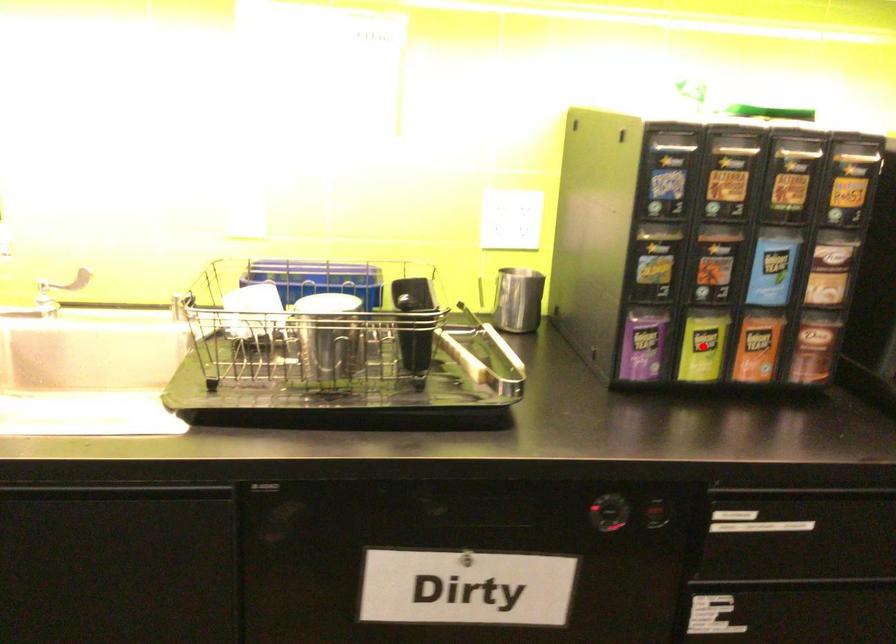
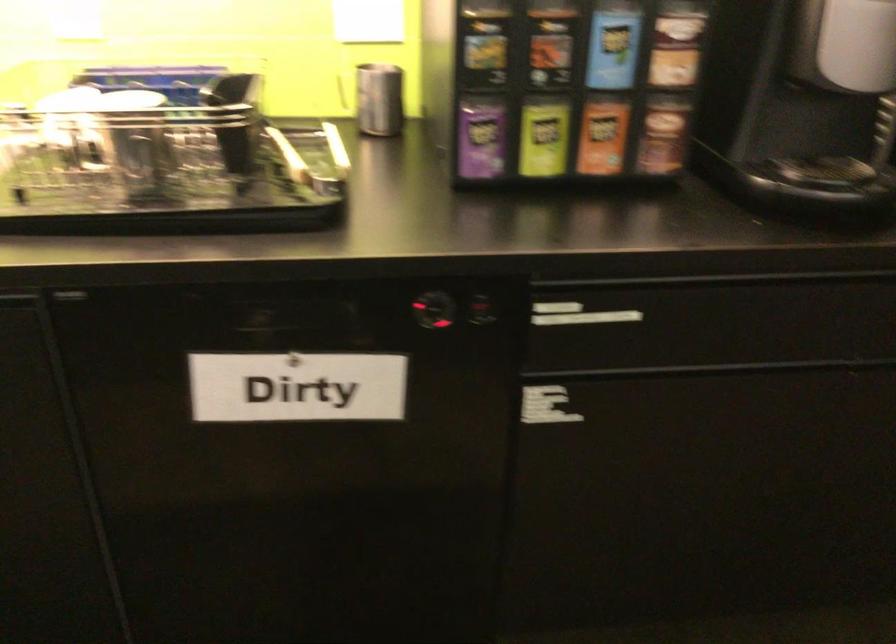
Question: I am providing you with two images of the same scene from different viewpoints. A red point is marked on the first image. Can you still see the location of the red point in image 2?

Choices:
 (A) Yes
 (B) No

Answer: (A)